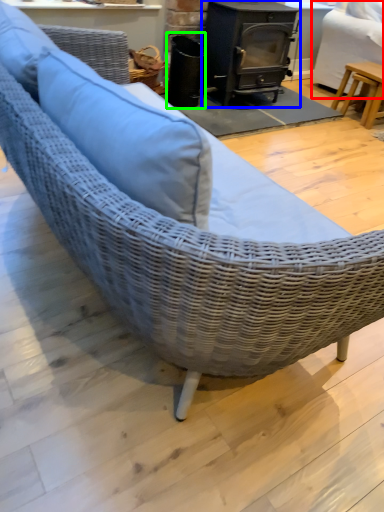
Question: Which is nearer to the swivel chair (highlighted by a red box)? wood burning stove (highlighted by a blue box) or appliance (highlighted by a green box).

Choices:
 (A) wood burning stove
 (B) appliance

Answer: (A)